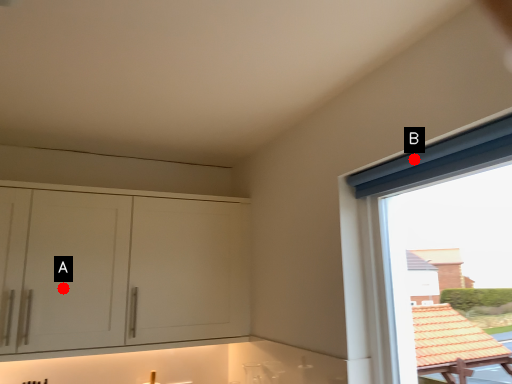
Question: Two points are circled on the image, labeled by A and B beside each circle. Which point is farther to the camera?

Choices:
 (A) A is further
 (B) B is further

Answer: (A)